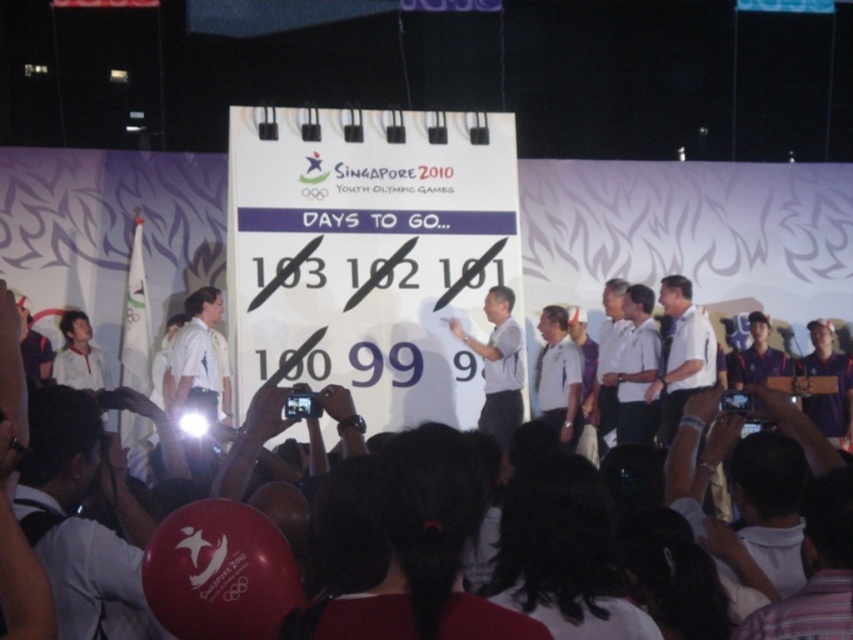
You are standing in front of the countdown signboard for the Singapore 2010 Youth Olympic Games. There are two points marked on the signboard at coordinates point (668, 426) and point (489, 429). Which point is closer to you?

Point (668, 426) is closer to the viewer than point (489, 429).